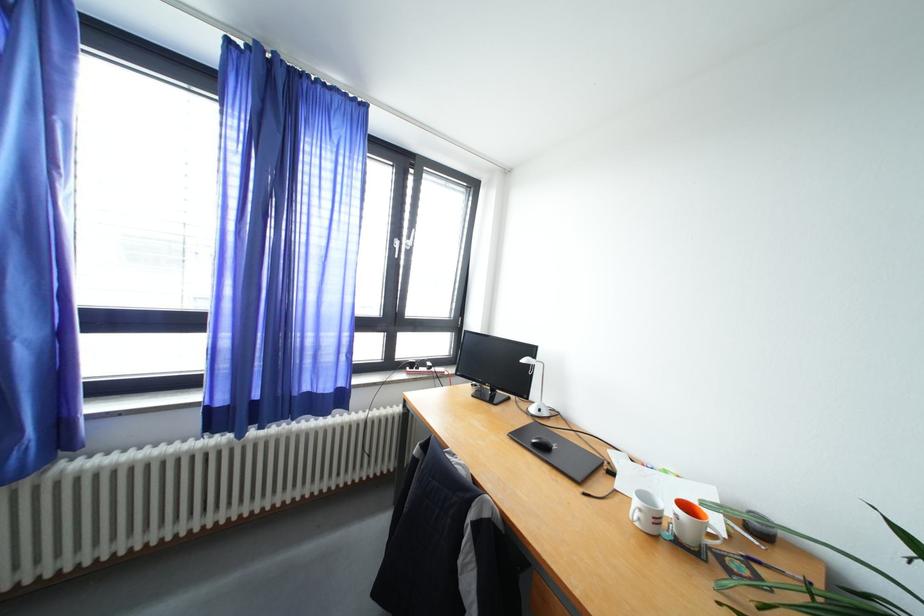
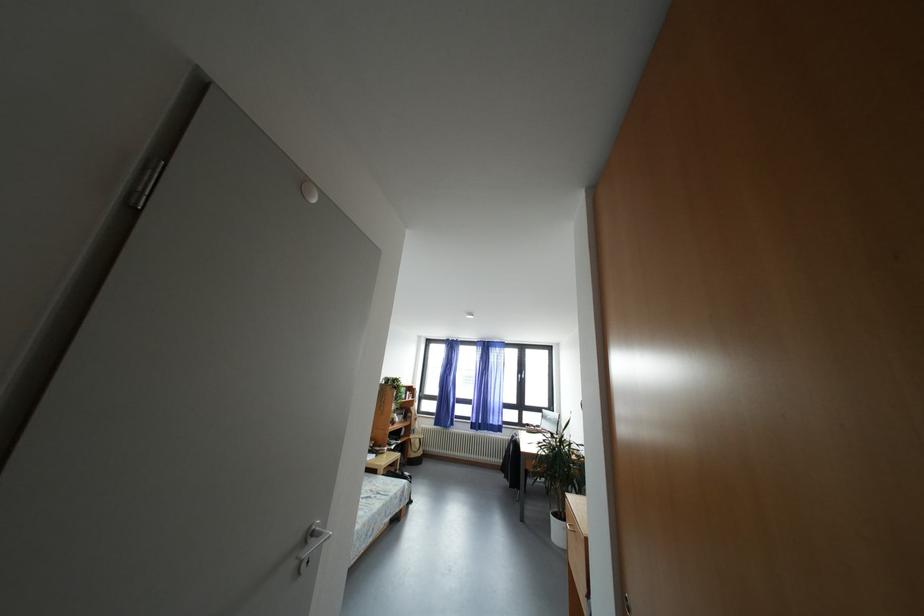
Find the pixel in the second image that matches [419,370] in the first image.

(533, 430)